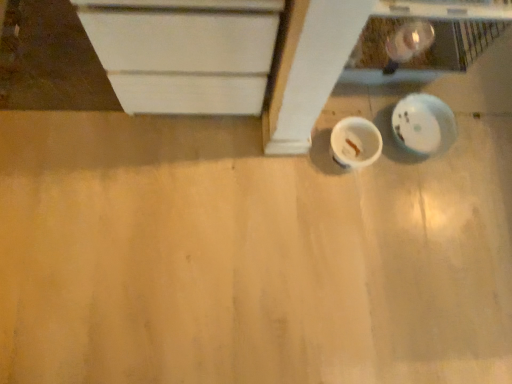
Identify the location of vacant space situated on the left part of white matte cabinet at upper left. The height and width of the screenshot is (384, 512). (51, 67).